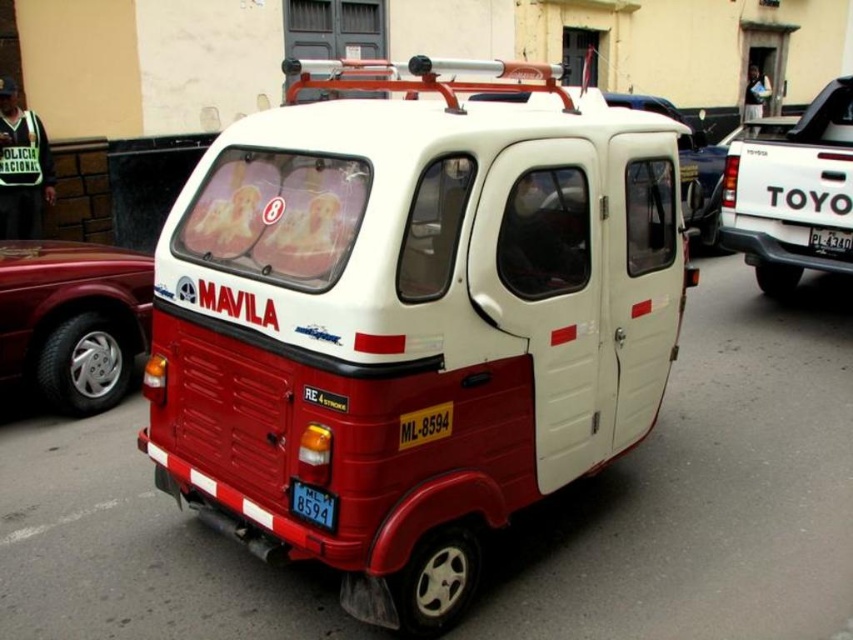
You are a delivery person needing to place a package between the matte red car at lower left and the black plastic license plate at center. The package is 6 meters long. Will it fit between them?

The distance between the matte red car at lower left and the black plastic license plate at center is 6.35 meters, so the 6 meters long package will fit between them since it is shorter than the available space.